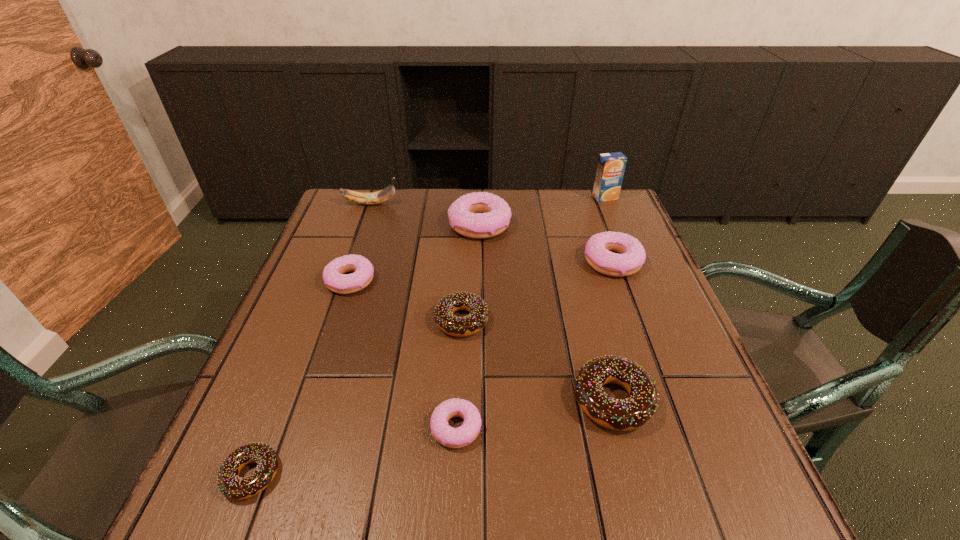
Locate an element on the screen. Image resolution: width=960 pixels, height=540 pixels. blue orange_juice is located at coordinates (611, 166).

You are a GUI agent. You are given a task and a screenshot of the screen. Output one action in this format:
    pyautogui.click(x=<x>, y=<y>)
    Task: Click on the tallest object
    Image resolution: width=960 pixels, height=540 pixels.
    Given the screenshot: What is the action you would take?
    pyautogui.click(x=611, y=166)

I want to click on yellow banana, so click(x=385, y=194).

At what (x,y) coordinates should I click in order to perform the action: click on the second tallest object. Please return your answer as a coordinate pair (x, y). Image resolution: width=960 pixels, height=540 pixels. Looking at the image, I should click on (385, 194).

This screenshot has height=540, width=960. I want to click on the tallest doughnut, so click(479, 215).

The height and width of the screenshot is (540, 960). Find the location of `the biggest purple doughnut`. the biggest purple doughnut is located at coordinates (479, 215).

What are the coordinates of `the second biggest purple doughnut` in the screenshot? It's located at (599, 249).

Identify the location of the biggest chocolate doughnut. (622, 415).

The height and width of the screenshot is (540, 960). Identify the location of the rightmost chocolate doughnut. (622, 415).

What are the coordinates of `the second smallest purple doughnut` in the screenshot? It's located at (334, 276).